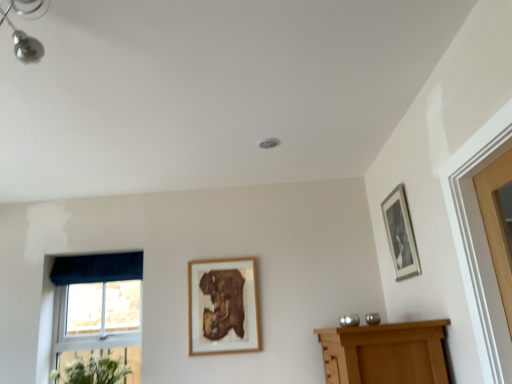
What is the approximate height of white matte flowers at lower left?

It is 9.72 inches.

This screenshot has width=512, height=384. Identify the location of blue fabric window at lower left. (99, 311).

At what (x,y) coordinates should I click in order to perform the action: click on velvet dark blue curtain at left. Please return your answer as a coordinate pair (x, y). Looking at the image, I should click on (97, 268).

From the image's perspective, is blue fabric window at lower left under white matte flowers at lower left?

No, from the image's perspective, blue fabric window at lower left is not beneath white matte flowers at lower left.

Considering the relative positions of blue fabric window at lower left and white matte flowers at lower left in the image provided, is blue fabric window at lower left to the right of white matte flowers at lower left from the viewer's perspective?

No, blue fabric window at lower left is not to the right of white matte flowers at lower left.

From a real-world perspective, between velvet dark blue curtain at left and silver metallic picture frame at upper right, placed as the 1th picture frame when sorted from right to left, who is vertically lower?

silver metallic picture frame at upper right, placed as the 1th picture frame when sorted from right to left, from a real-world perspective.

Identify the location of curtain behind the silver metallic picture frame at upper right, the 2th picture frame in the bottom-to-top sequence. This screenshot has height=384, width=512. (97, 268).

Is velvet dark blue curtain at left looking in the opposite direction of silver metallic picture frame at upper right, the second picture frame when ordered from back to front?

No, velvet dark blue curtain at left's orientation is not away from silver metallic picture frame at upper right, the second picture frame when ordered from back to front.

Looking at this image, which of these two, velvet dark blue curtain at left or silver metallic picture frame at upper right, which is counted as the first picture frame, starting from the front, is wider?

velvet dark blue curtain at left is wider.

Is point (238, 277) farther from viewer compared to point (86, 257)?

That is False.

From a real-world perspective, relative to velvet dark blue curtain at left, is wooden frame at center, which is the first picture frame in back-to-front order, vertically above or below?

wooden frame at center, which is the first picture frame in back-to-front order, is below velvet dark blue curtain at left.

Which of these two, wooden frame at center, which is the second picture frame from right to left, or velvet dark blue curtain at left, is wider?

Wider between the two is velvet dark blue curtain at left.

Would you say wooden frame at center, arranged as the 2th picture frame when viewed from the top, contains velvet dark blue curtain at left?

No, velvet dark blue curtain at left is located outside of wooden frame at center, arranged as the 2th picture frame when viewed from the top.

Is the surface of white matte flowers at lower left in direct contact with silver metallic picture frame at upper right, the 2th picture frame in the bottom-to-top sequence?

No, white matte flowers at lower left is not in contact with silver metallic picture frame at upper right, the 2th picture frame in the bottom-to-top sequence.

From the image's perspective, would you say white matte flowers at lower left is positioned over silver metallic picture frame at upper right, the 2th picture frame in the bottom-to-top sequence?

No.

Between white matte flowers at lower left and silver metallic picture frame at upper right, placed as the 1th picture frame when sorted from right to left, which one has larger width?

white matte flowers at lower left is wider.

From a real-world perspective, between wooden frame at center, the second picture frame viewed from the front, and blue fabric window at lower left, who is vertically higher?

wooden frame at center, the second picture frame viewed from the front, from a real-world perspective.

Between wooden frame at center, the second picture frame viewed from the front, and blue fabric window at lower left, which one has less height?

With less height is wooden frame at center, the second picture frame viewed from the front.

Consider the image. Is there a large distance between wooden frame at center, which is the second picture frame from right to left, and blue fabric window at lower left?

wooden frame at center, which is the second picture frame from right to left, is near blue fabric window at lower left, not far away.

How distant is wooden frame at center, arranged as the 2th picture frame when viewed from the top, from blue fabric window at lower left?

27.80 inches.

Choose the correct answer: Is blue fabric window at lower left inside silver metallic picture frame at upper right, the second picture frame when ordered from back to front, or outside it?

blue fabric window at lower left is not enclosed by silver metallic picture frame at upper right, the second picture frame when ordered from back to front.

Which is more to the right, blue fabric window at lower left or silver metallic picture frame at upper right, the second picture frame when ordered from back to front?

silver metallic picture frame at upper right, the second picture frame when ordered from back to front.

Consider the image. How many degrees apart are the facing directions of blue fabric window at lower left and silver metallic picture frame at upper right, the first picture frame positioned from the top?

blue fabric window at lower left and silver metallic picture frame at upper right, the first picture frame positioned from the top, are facing 90 degrees away from each other.

Is blue fabric window at lower left facing away from silver metallic picture frame at upper right, which is counted as the first picture frame, starting from the front?

No, silver metallic picture frame at upper right, which is counted as the first picture frame, starting from the front, is not at the back of blue fabric window at lower left.

Identify the location of picture frame that is the 1st object located above the white matte flowers at lower left (from the image's perspective). (223, 306).

Would you say white matte flowers at lower left is inside or outside wooden frame at center, the second picture frame viewed from the front?

white matte flowers at lower left cannot be found inside wooden frame at center, the second picture frame viewed from the front.

Considering the relative sizes of white matte flowers at lower left and wooden frame at center, which is the first picture frame in back-to-front order, in the image provided, is white matte flowers at lower left shorter than wooden frame at center, which is the first picture frame in back-to-front order,?

Indeed, white matte flowers at lower left has a lesser height compared to wooden frame at center, which is the first picture frame in back-to-front order.

Which of these two, white matte flowers at lower left or wooden frame at center, which is counted as the 1th picture frame, starting from the left, is bigger?

Bigger between the two is white matte flowers at lower left.

Find the location of a particular element. Image resolution: width=512 pixels, height=384 pixels. flower lying on the right of blue fabric window at lower left is located at coordinates (91, 371).

From the velvet dark blue curtain at left, count 2nd picture frames forward and point to it. Please provide its 2D coordinates.

[(400, 234)]

Which object lies further to the anchor point velvet dark blue curtain at left, silver metallic picture frame at upper right, which is counted as the first picture frame, starting from the front, or blue fabric window at lower left?

The object further to velvet dark blue curtain at left is silver metallic picture frame at upper right, which is counted as the first picture frame, starting from the front.

When comparing their distances from velvet dark blue curtain at left, does silver metallic picture frame at upper right, the first picture frame positioned from the top, or wooden frame at center, arranged as the 2th picture frame when viewed from the top, seem closer?

The object closer to velvet dark blue curtain at left is wooden frame at center, arranged as the 2th picture frame when viewed from the top.

Looking at the image, which one is located closer to white matte flowers at lower left, wooden frame at center, which is the second picture frame from right to left, or blue fabric window at lower left?

The object closer to white matte flowers at lower left is blue fabric window at lower left.

Estimate the real-world distances between objects in this image. Which object is further from blue fabric window at lower left, silver metallic picture frame at upper right, which is counted as the first picture frame, starting from the front, or wooden frame at center, arranged as the 2th picture frame when viewed from the top?

silver metallic picture frame at upper right, which is counted as the first picture frame, starting from the front.

Based on their spatial positions, is velvet dark blue curtain at left or silver metallic picture frame at upper right, the 2th picture frame when ordered from left to right, further from blue fabric window at lower left?

Among the two, silver metallic picture frame at upper right, the 2th picture frame when ordered from left to right, is located further to blue fabric window at lower left.

Consider the image. Based on their spatial positions, is white matte flowers at lower left or blue fabric window at lower left closer to velvet dark blue curtain at left?

The object closer to velvet dark blue curtain at left is blue fabric window at lower left.

Based on their spatial positions, is white matte flowers at lower left or blue fabric window at lower left further from wooden frame at center, acting as the first picture frame starting from the bottom?

Based on the image, white matte flowers at lower left appears to be further to wooden frame at center, acting as the first picture frame starting from the bottom.

Considering their positions, is velvet dark blue curtain at left positioned further to white matte flowers at lower left than blue fabric window at lower left?

velvet dark blue curtain at left is further to white matte flowers at lower left.

Find the location of `picture frame located between velvet dark blue curtain at left and silver metallic picture frame at upper right, the 2th picture frame in the bottom-to-top sequence, in the left-right direction`. picture frame located between velvet dark blue curtain at left and silver metallic picture frame at upper right, the 2th picture frame in the bottom-to-top sequence, in the left-right direction is located at coordinates (223, 306).

I want to click on window between velvet dark blue curtain at left and wooden frame at center, which is the first picture frame in back-to-front order, so click(99, 311).

Where is `flower between blue fabric window at lower left and wooden frame at center, which is the second picture frame from right to left, in the horizontal direction`? Image resolution: width=512 pixels, height=384 pixels. flower between blue fabric window at lower left and wooden frame at center, which is the second picture frame from right to left, in the horizontal direction is located at coordinates (91, 371).

You are a GUI agent. You are given a task and a screenshot of the screen. Output one action in this format:
    pyautogui.click(x=<x>, y=<y>)
    Task: Click on the flower between velvet dark blue curtain at left and wooden frame at center, which is the second picture frame from right to left, in the horizontal direction
    The height and width of the screenshot is (384, 512).
    Given the screenshot: What is the action you would take?
    pyautogui.click(x=91, y=371)